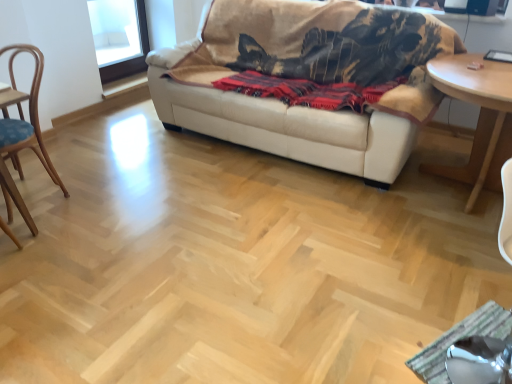
I want to click on vacant area to the left of light brown wooden table at right, so click(337, 200).